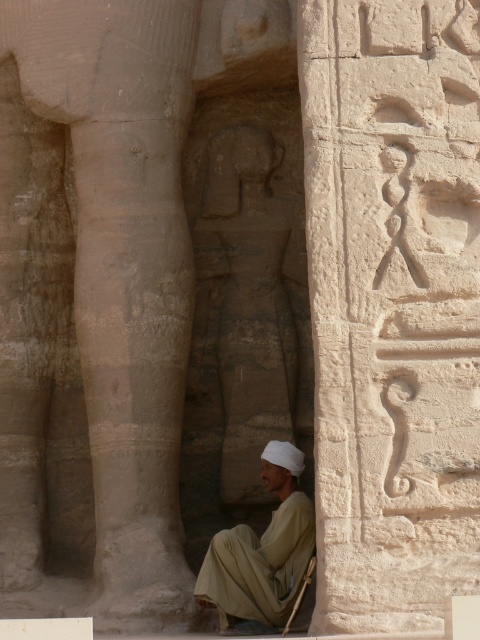
Question: Can you confirm if smooth stone hieroglyphs at center is smaller than gray stone statue at center?

Choices:
 (A) no
 (B) yes

Answer: (A)

Question: Is smooth stone hieroglyphs at center above beige cotton robe at lower center?

Choices:
 (A) no
 (B) yes

Answer: (B)

Question: Which point is farther to the camera?

Choices:
 (A) beige cotton robe at lower center
 (B) smooth stone hieroglyphs at center

Answer: (A)

Question: Based on their relative distances, which object is farther from the smooth stone hieroglyphs at center?

Choices:
 (A) gray stone statue at center
 (B) beige cotton robe at lower center

Answer: (A)

Question: Which is nearer to the gray stone statue at center?

Choices:
 (A) beige cotton robe at lower center
 (B) smooth stone hieroglyphs at center

Answer: (A)

Question: Does gray stone statue at center come in front of beige cotton robe at lower center?

Choices:
 (A) yes
 (B) no

Answer: (B)